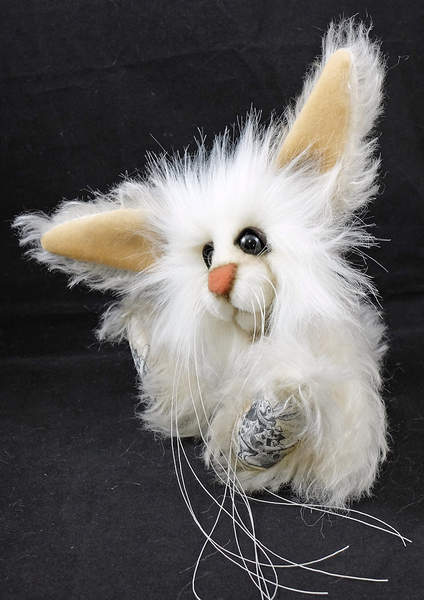
Identify the location of toy. The width and height of the screenshot is (424, 600). (284, 348), (182, 334), (313, 282), (169, 273), (321, 386), (179, 390), (256, 421).